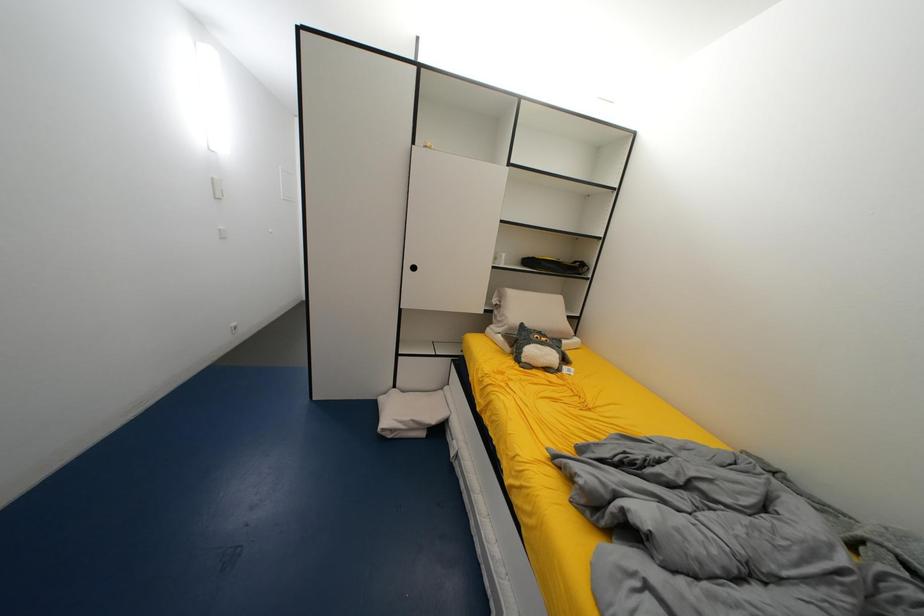
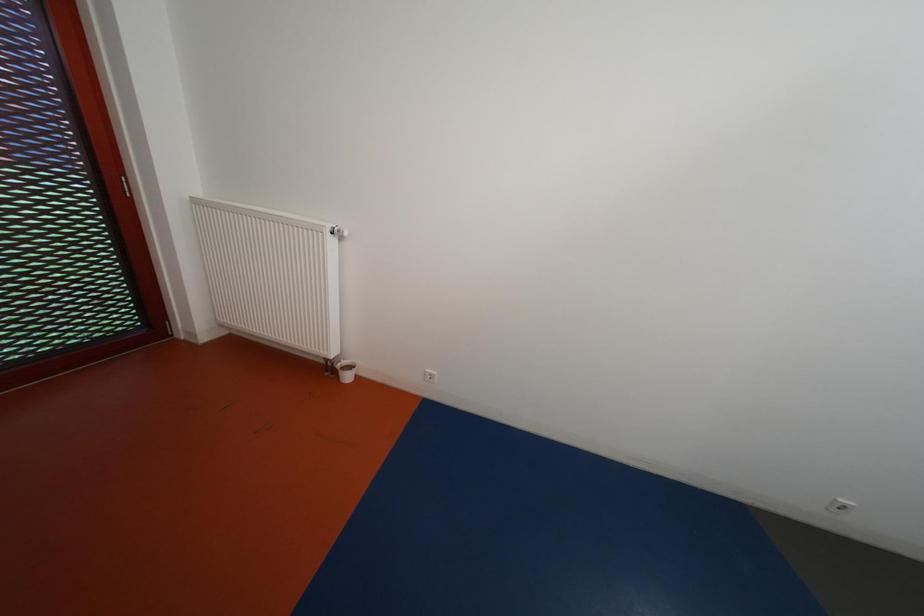
How did the camera likely rotate?

The camera's rotation is toward left-down.